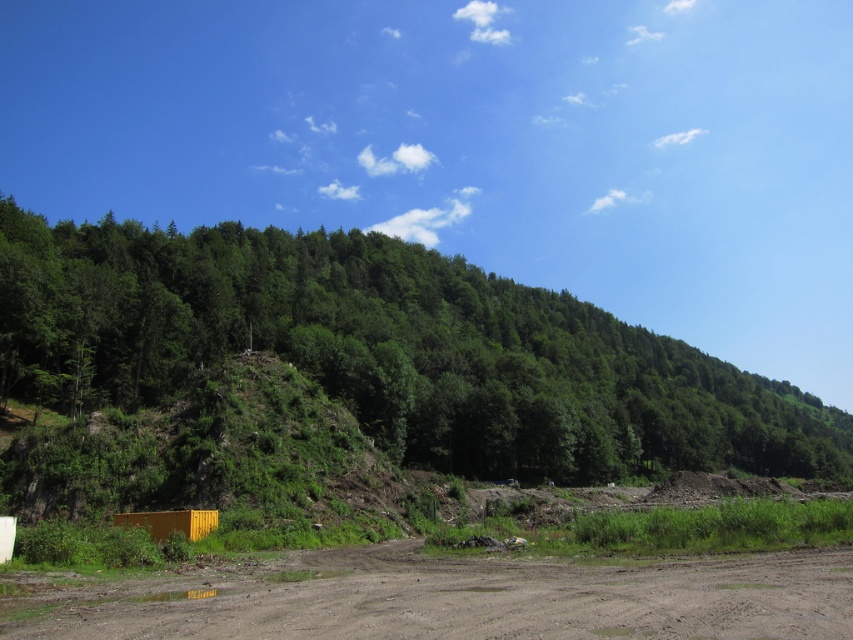
You are a hiker planning to set up a tent in the brown muddy dirt field at lower center. Considering the size of the green leafy tree at center, will there be enough space to accommodate a standard tent that requires 10 meters of width?

The green leafy tree at center is wider than the brown muddy dirt field at lower center, so the field may not provide sufficient width for a standard tent requiring 10 meters. Check the actual dimensions before setting up.

You are planning to set up a tent for a camping trip. You have two options for the location. One is near the green leafy tree at center and the other is on the brown muddy dirt field at lower center. Which location would provide more shade during the day?

The green leafy tree at center is much taller than the brown muddy dirt field at lower center, so the area near the green leafy tree at center would provide more shade during the day.